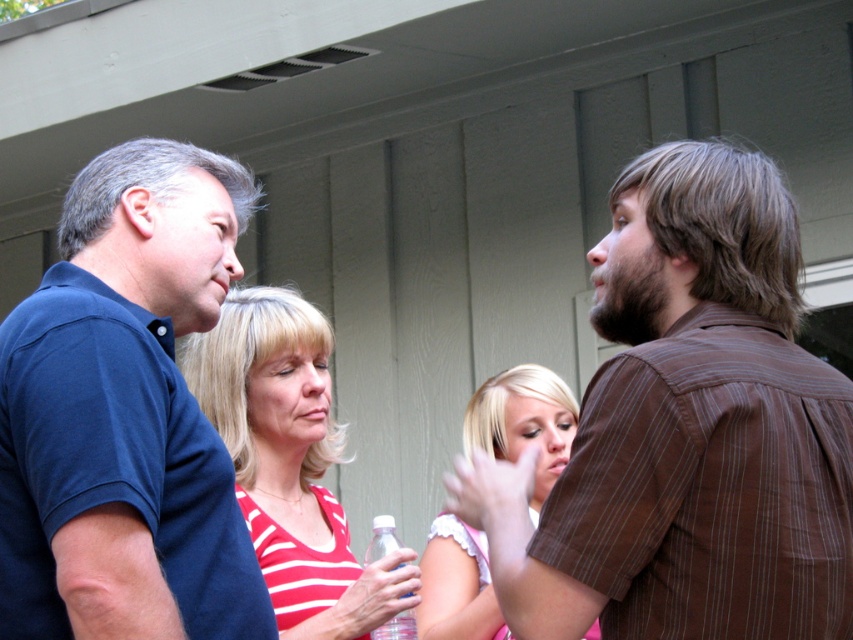
Does striped fabric tank top at center appear under blonde hair at center?

Yes, striped fabric tank top at center is below blonde hair at center.

Is striped fabric tank top at center above blonde hair at center?

Actually, striped fabric tank top at center is below blonde hair at center.

Describe the element at coordinates (288, 461) in the screenshot. I see `striped fabric tank top at center` at that location.

Find the location of `striped fabric tank top at center`. striped fabric tank top at center is located at coordinates (288, 461).

Measure the distance from blonde hair at center to clear plastic bottle at center.

blonde hair at center and clear plastic bottle at center are 3.77 feet apart from each other.

Is point (479, 540) in front of point (374, 637)?

That is False.

I want to click on blonde hair at center, so click(523, 422).

The height and width of the screenshot is (640, 853). What are the coordinates of `blonde hair at center` in the screenshot? It's located at (523, 422).

In the scene shown: Who is positioned more to the left, brown striped shirt at right or clear plastic bottle at center?

Positioned to the left is clear plastic bottle at center.

Looking at this image, is brown striped shirt at right to the right of clear plastic bottle at center from the viewer's perspective?

Yes, brown striped shirt at right is to the right of clear plastic bottle at center.

Describe the element at coordinates (688, 432) in the screenshot. I see `brown striped shirt at right` at that location.

You are a GUI agent. You are given a task and a screenshot of the screen. Output one action in this format:
    pyautogui.click(x=<x>, y=<y>)
    Task: Click on the brown striped shirt at right
    This screenshot has height=640, width=853.
    Given the screenshot: What is the action you would take?
    pyautogui.click(x=688, y=432)